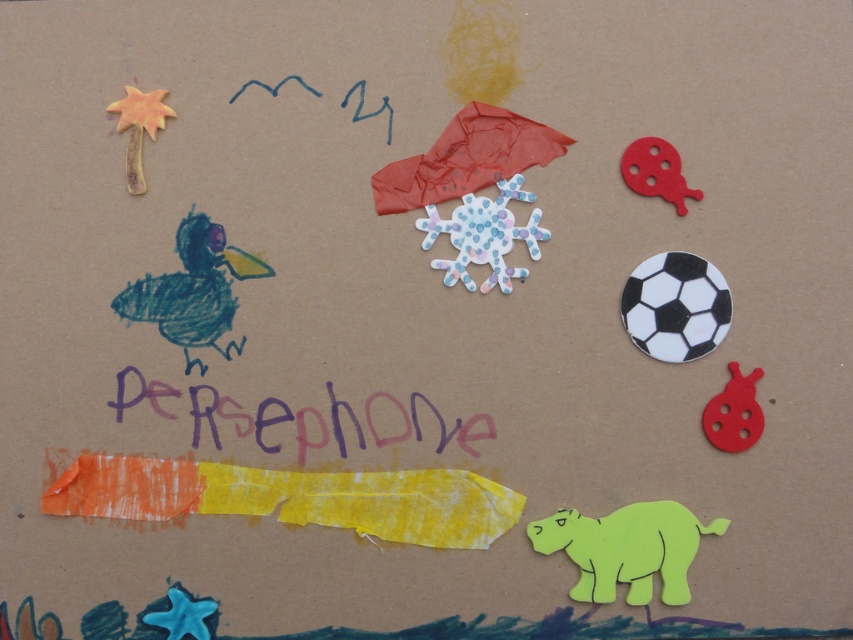
Question: Estimate the real-world distances between objects in this image. Which object is closer to the purple painted text at center?

Choices:
 (A) orange clay palm tree at upper left
 (B) red felt ladybug at upper right
 (C) orange/yellow paper strip at bottom center

Answer: (C)

Question: Among these points, which one is farthest from the camera?

Choices:
 (A) (676, 200)
 (B) (677, 276)
 (C) (483, 488)

Answer: (A)

Question: Is pastel paper snowflake at center to the right of matte red ladybug at lower right from the viewer's perspective?

Choices:
 (A) yes
 (B) no

Answer: (B)

Question: Can you confirm if pastel paper snowflake at center is wider than orange clay palm tree at upper left?

Choices:
 (A) no
 (B) yes

Answer: (B)

Question: Does purple painted text at center have a smaller size compared to matte red ladybug at lower right?

Choices:
 (A) no
 (B) yes

Answer: (A)

Question: Which point is farther from the camera taking this photo?

Choices:
 (A) (634, 339)
 (B) (671, 168)
 (C) (679, 525)

Answer: (A)